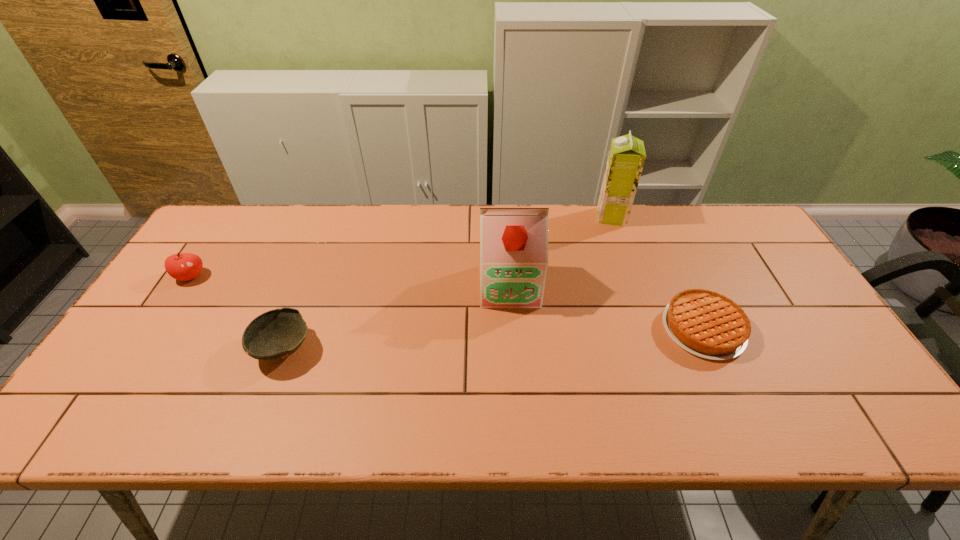
Find the location of a particular element. Image resolution: width=960 pixels, height=540 pixels. vacant position located with the cap open on the left soya milk is located at coordinates (518, 427).

Image resolution: width=960 pixels, height=540 pixels. In order to click on vacant space positioned 0.090m on the front of the leftmost object in this screenshot , I will do `click(169, 310)`.

I want to click on vacant space located on the right of the fourth object from right to left, so click(398, 348).

I want to click on vacant area located 0.080m on the front of the shortest object, so coord(732,392).

Identify the location of object that is at the far edge. The height and width of the screenshot is (540, 960). (626, 158).

This screenshot has width=960, height=540. Identify the location of object at the left edge. (182, 266).

Identify the location of free space at the far edge. The height and width of the screenshot is (540, 960). (500, 204).

The width and height of the screenshot is (960, 540). I want to click on free space at the near edge, so point(535,434).

This screenshot has width=960, height=540. Find the location of `free space at the right edge`. free space at the right edge is located at coordinates (770, 298).

Identify the location of vacant space at the far right corner. The height and width of the screenshot is (540, 960). (742, 229).